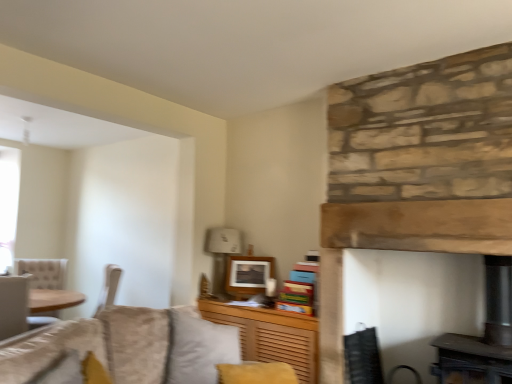
Describe the element at coordinates (362, 357) in the screenshot. This screenshot has width=512, height=384. I see `black mesh swivel chair at lower right` at that location.

Find the location of a particular element. wooden cabinet at lower center is located at coordinates point(271,335).

Locate an element on the screen. The width and height of the screenshot is (512, 384). white fabric lampshade at upper center is located at coordinates (222, 254).

At what (x,y) coordinates should I click in order to perform the action: click on black mesh swivel chair at lower right. Please return your answer as a coordinate pair (x, y). Image resolution: width=512 pixels, height=384 pixels. Looking at the image, I should click on (362, 357).

Is black mesh swivel chair at lower right inside or outside of white fabric lampshade at upper center?

black mesh swivel chair at lower right exists outside the volume of white fabric lampshade at upper center.

From a real-world perspective, which is physically below, black mesh swivel chair at lower right or white fabric lampshade at upper center?

black mesh swivel chair at lower right, from a real-world perspective.

Is black mesh swivel chair at lower right touching white fabric lampshade at upper center?

No, black mesh swivel chair at lower right is not touching white fabric lampshade at upper center.

Considering the sizes of objects black mesh swivel chair at lower right and white fabric lampshade at upper center in the image provided, who is taller, black mesh swivel chair at lower right or white fabric lampshade at upper center?

Standing taller between the two is white fabric lampshade at upper center.

Locate an element on the screen. pillow on the left side of white fabric lampshade at upper center is located at coordinates (199, 348).

Is velvet gray pillow at center not near white fabric lampshade at upper center?

Indeed, velvet gray pillow at center is not near white fabric lampshade at upper center.

Choose the correct answer: Is velvet gray pillow at center inside white fabric lampshade at upper center or outside it?

The correct answer is: outside.

From the image's perspective, is velvet gray pillow at center over white fabric lampshade at upper center?

No, from the image's perspective, velvet gray pillow at center is not over white fabric lampshade at upper center.

Considering the sizes of objects black mesh swivel chair at lower right and natural stone fireplace at center in the image provided, who is smaller, black mesh swivel chair at lower right or natural stone fireplace at center?

black mesh swivel chair at lower right is smaller.

Based on the photo, from their relative heights in the image, would you say black mesh swivel chair at lower right is taller or shorter than natural stone fireplace at center?

Considering their sizes, black mesh swivel chair at lower right has less height than natural stone fireplace at center.

From a real-world perspective, is black mesh swivel chair at lower right over natural stone fireplace at center?

No.

Considering the positions of objects black mesh swivel chair at lower right and natural stone fireplace at center in the image provided, who is more to the left, black mesh swivel chair at lower right or natural stone fireplace at center?

Positioned to the left is black mesh swivel chair at lower right.

Consider the image. Is velvet gray pillow at center at the right side of wooden cabinet at lower center?

No.

Is velvet gray pillow at center not close to wooden cabinet at lower center?

That's not correct — velvet gray pillow at center is a little close to wooden cabinet at lower center.

Is velvet gray pillow at center positioned beyond the bounds of wooden cabinet at lower center?

Absolutely, velvet gray pillow at center is external to wooden cabinet at lower center.

Is velvet gray pillow at center looking in the opposite direction of wooden cabinet at lower center?

No, wooden cabinet at lower center is not at the back of velvet gray pillow at center.

From a real-world perspective, is velvet gray pillow at center over matte white picture frame at upper center?

No.

Who is smaller, velvet gray pillow at center or matte white picture frame at upper center?

Smaller between the two is matte white picture frame at upper center.

From the image's perspective, is velvet gray pillow at center above or below matte white picture frame at upper center?

Clearly, from the image's perspective, velvet gray pillow at center is below matte white picture frame at upper center.

Is point (382, 139) in front of point (308, 342)?

Yes, it is.

The height and width of the screenshot is (384, 512). Find the location of `cabinetry below the natural stone fireplace at center (from the image's perspective)`. cabinetry below the natural stone fireplace at center (from the image's perspective) is located at coordinates (271, 335).

From a real-world perspective, does natural stone fireplace at center stand above wooden cabinet at lower center?

Yes, from a real-world perspective, natural stone fireplace at center is on top of wooden cabinet at lower center.

Is velvet gray pillow at center with natural stone fireplace at center?

velvet gray pillow at center and natural stone fireplace at center are clearly separated.

Which object is thinner, velvet gray pillow at center or natural stone fireplace at center?

Thinner between the two is natural stone fireplace at center.

From a real-world perspective, between velvet gray pillow at center and natural stone fireplace at center, who is vertically higher?

natural stone fireplace at center is physically above.

In the image, there is a black mesh swivel chair at lower right. What are the coordinates of `lamp above it (from the image's perspective)` in the screenshot? It's located at (222, 254).

Locate an element on the screen. Image resolution: width=512 pixels, height=384 pixels. lamp that is above the velvet gray pillow at center (from a real-world perspective) is located at coordinates (222, 254).

Based on their spatial positions, is wooden cabinet at lower center or velvet gray pillow at center further from natural stone fireplace at center?

The object further to natural stone fireplace at center is velvet gray pillow at center.

Considering their positions, is wooden cabinet at lower center positioned closer to black mesh swivel chair at lower right than matte white picture frame at upper center?

wooden cabinet at lower center is closer to black mesh swivel chair at lower right.

Based on their spatial positions, is matte white picture frame at upper center or wooden cabinet at lower center closer to black mesh swivel chair at lower right?

The object closer to black mesh swivel chair at lower right is wooden cabinet at lower center.

When comparing their distances from black mesh swivel chair at lower right, does velvet gray pillow at center or white fabric lampshade at upper center seem closer?

velvet gray pillow at center.

From the image, which object appears to be farther from natural stone fireplace at center, white fabric lampshade at upper center or matte white picture frame at upper center?

The object further to natural stone fireplace at center is white fabric lampshade at upper center.

Which object lies nearer to the anchor point matte white picture frame at upper center, white fabric lampshade at upper center or wooden cabinet at lower center?

The object closer to matte white picture frame at upper center is white fabric lampshade at upper center.

Considering their positions, is matte white picture frame at upper center positioned further to natural stone fireplace at center than black mesh swivel chair at lower right?

matte white picture frame at upper center is further to natural stone fireplace at center.

From the image, which object appears to be farther from velvet gray pillow at center, wooden cabinet at lower center or black mesh swivel chair at lower right?

Based on the image, black mesh swivel chair at lower right appears to be further to velvet gray pillow at center.

Image resolution: width=512 pixels, height=384 pixels. Find the location of `swivel chair positioned between velvet gray pillow at center and matte white picture frame at upper center from near to far`. swivel chair positioned between velvet gray pillow at center and matte white picture frame at upper center from near to far is located at coordinates (362, 357).

The image size is (512, 384). In order to click on cabinetry located between natural stone fireplace at center and white fabric lampshade at upper center in the depth direction in this screenshot , I will do `click(271, 335)`.

Find the location of a particular element. Image resolution: width=512 pixels, height=384 pixels. cabinetry between velvet gray pillow at center and natural stone fireplace at center from left to right is located at coordinates (271, 335).

Locate an element on the screen. This screenshot has height=384, width=512. cabinetry located between natural stone fireplace at center and matte white picture frame at upper center in the depth direction is located at coordinates (271, 335).